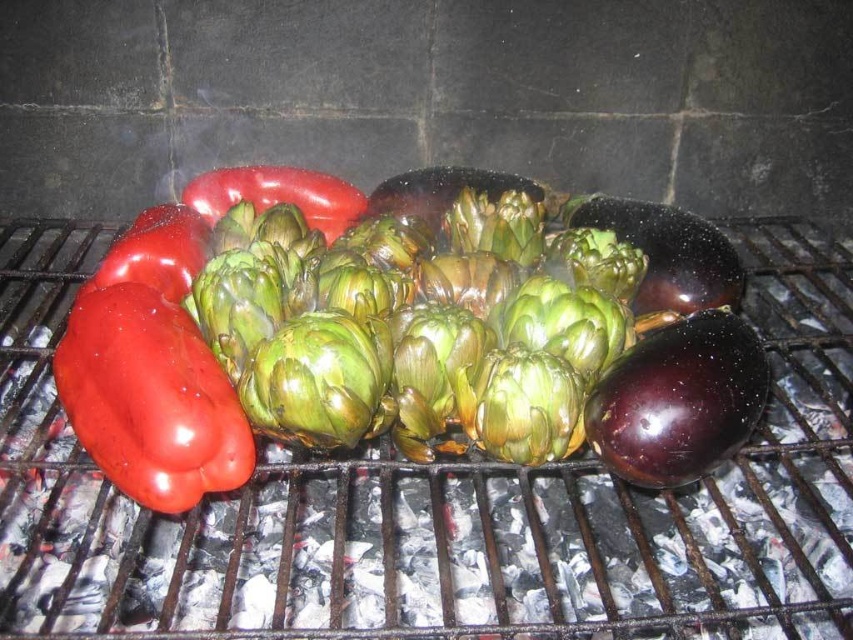
Find the location of a particular element. green matte artichoke at center is located at coordinates (416, 326).

Is green matte artichoke at center shorter than shiny red bell pepper at left?

Incorrect, green matte artichoke at center's height does not fall short of shiny red bell pepper at left's.

What are the coordinates of `green matte artichoke at center` in the screenshot? It's located at (416, 326).

You are a GUI agent. You are given a task and a screenshot of the screen. Output one action in this format:
    pyautogui.click(x=<x>, y=<y>)
    Task: Click on the green matte artichoke at center
    The image size is (853, 640).
    Given the screenshot: What is the action you would take?
    pyautogui.click(x=416, y=326)

The width and height of the screenshot is (853, 640). What do you see at coordinates (149, 397) in the screenshot? I see `shiny red bell pepper at left` at bounding box center [149, 397].

Describe the element at coordinates (149, 397) in the screenshot. The image size is (853, 640). I see `shiny red bell pepper at left` at that location.

Locate an element on the screen. Image resolution: width=853 pixels, height=640 pixels. shiny red bell pepper at left is located at coordinates (149, 397).

How much distance is there between green matte artichoke at center and shiny dark purple eggplant at center-right?

12.16 inches

Is green matte artichoke at center further to the viewer compared to shiny dark purple eggplant at center-right?

That is False.

Identify the location of green matte artichoke at center. (416, 326).